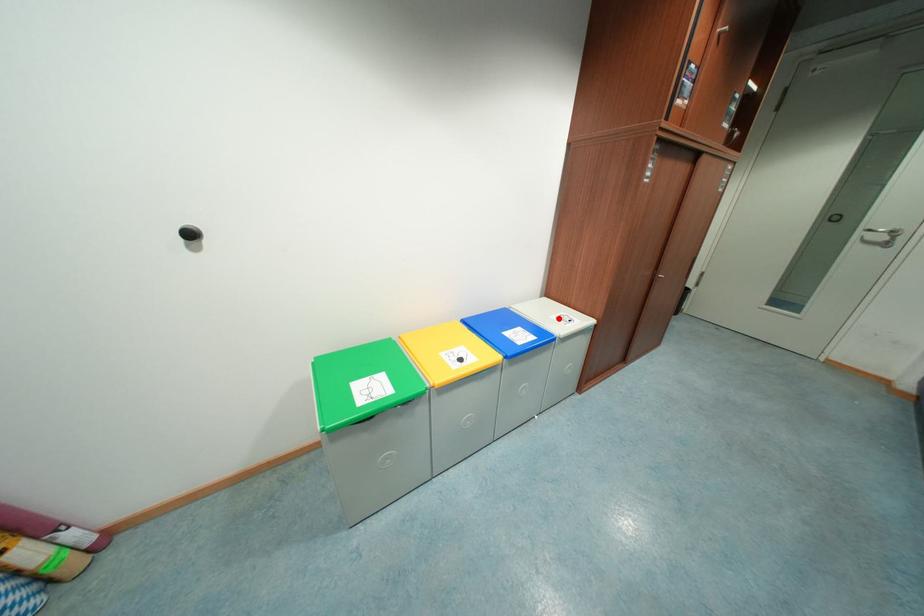
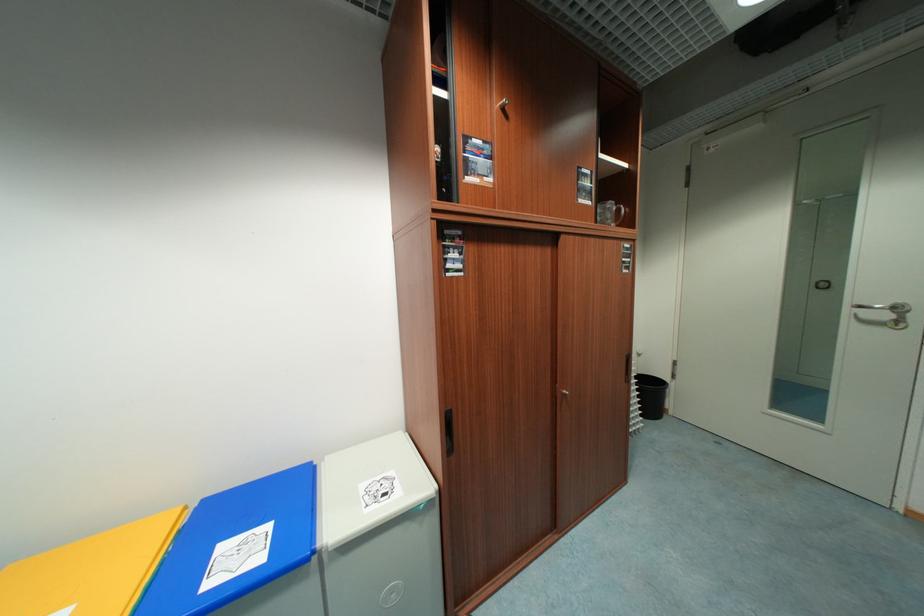
In the second image, find the point that corresponds to the highlighted location in the first image.

(369, 488)